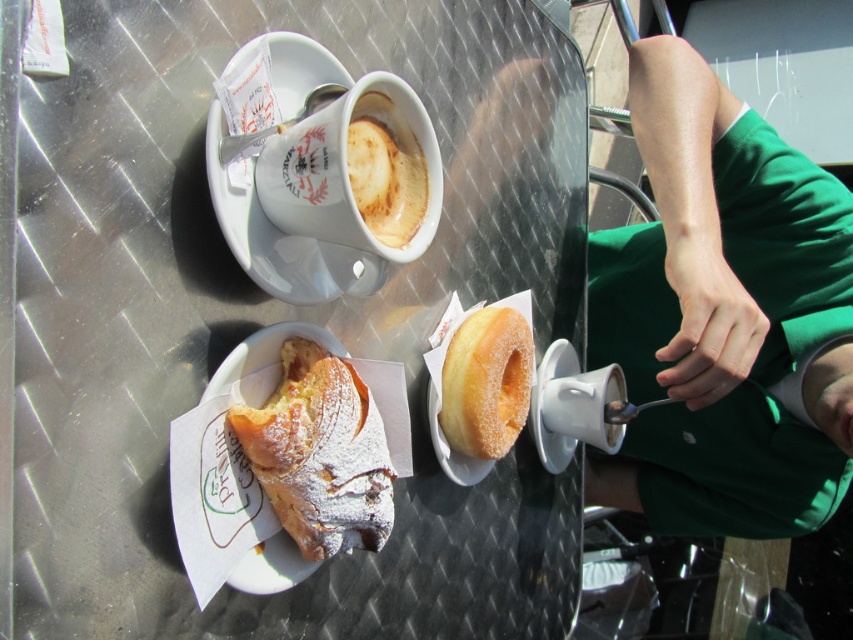
You are a customer at the outdoor cafe and want to grab both the white ceramic saucer at upper left and the sugared doughnut at center. Which one should you reach for first if you want to pick up the item that is closer to your right hand?

The sugared doughnut at center is to the right of the white ceramic saucer at upper left, so you should reach for the sugared doughnut at center first as it is closer to your right hand.

You are a customer at the outdoor cafe and want to place your phone on the table. The phone is 0.5 cm thick. Which object between the white ceramic saucer at upper left and the sugared doughnut at center would allow the phone to be placed underneath it without touching the table?

The white ceramic saucer at upper left is thinner than the sugared doughnut at center, so placing the phone underneath the white ceramic saucer at upper left would leave enough space between the phone and the table.